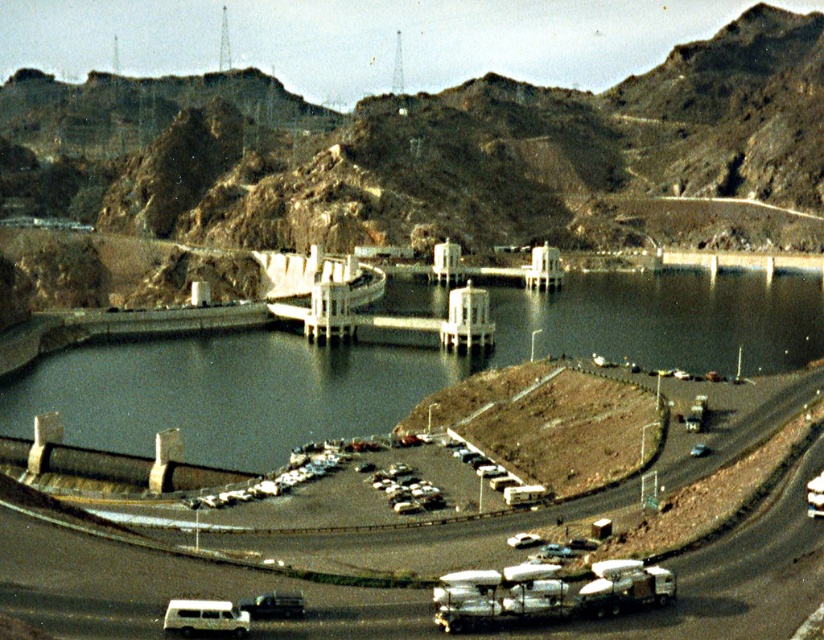
Is white matte van at lower left closer to the viewer compared to white matte car at center?

Yes, white matte van at lower left is in front of white matte car at center.

Where is `white matte van at lower left`? white matte van at lower left is located at coordinates [x=206, y=616].

Identify the location of white matte van at lower left. The height and width of the screenshot is (640, 824). (206, 616).

Does clear water at center appear on the left side of white matte car at center?

Incorrect, clear water at center is not on the left side of white matte car at center.

Who is higher up, clear water at center or white matte car at center?

clear water at center is higher up.

Who is more distant from viewer, (553, 304) or (438, 490)?

The point (553, 304) is more distant.

The image size is (824, 640). I want to click on clear water at center, so click(x=398, y=364).

Looking at this image, who is shorter, smooth asphalt highway at lower center or metallic silver car at center?

metallic silver car at center

Is point (612, 502) farther from camera compared to point (269, 614)?

That is True.

Who is more forward, (195,564) or (293,604)?

Point (293,604)

This screenshot has width=824, height=640. In order to click on smooth asphalt highway at lower center in this screenshot , I will do `click(166, 586)`.